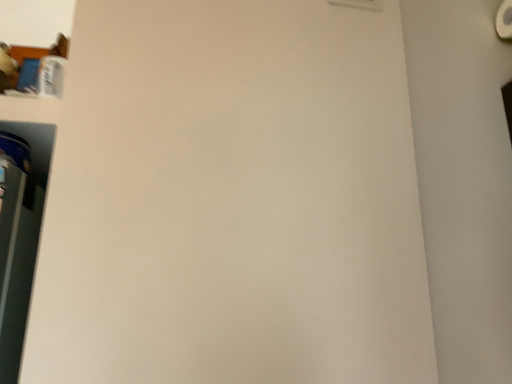
Describe the element at coordinates (33, 70) in the screenshot. The image size is (512, 384). I see `white cardboard box at upper left` at that location.

You are a GUI agent. You are given a task and a screenshot of the screen. Output one action in this format:
    pyautogui.click(x=<x>, y=<y>)
    Task: Click on the white cardboard box at upper left
    
    Given the screenshot: What is the action you would take?
    pyautogui.click(x=33, y=70)

Image resolution: width=512 pixels, height=384 pixels. What are the coordinates of `white cardboard box at upper left` in the screenshot? It's located at (33, 70).